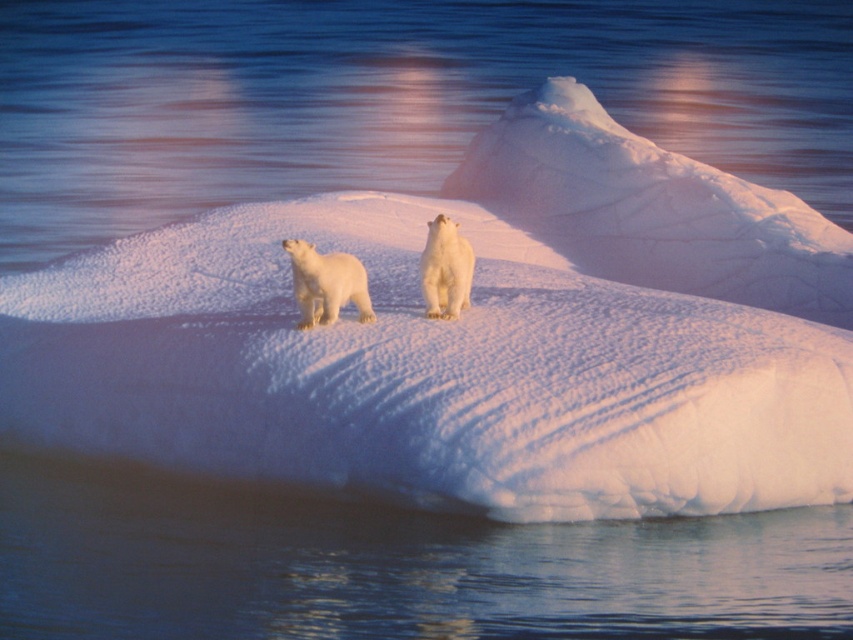
You are a wildlife photographer trying to capture a photo of both the white fur polar bear at left and the white fur bear at center. Since you want to ensure both are in focus, you need to know their heights. Which bear is taller?

The white fur bear at center is taller than the white fur polar bear at left.